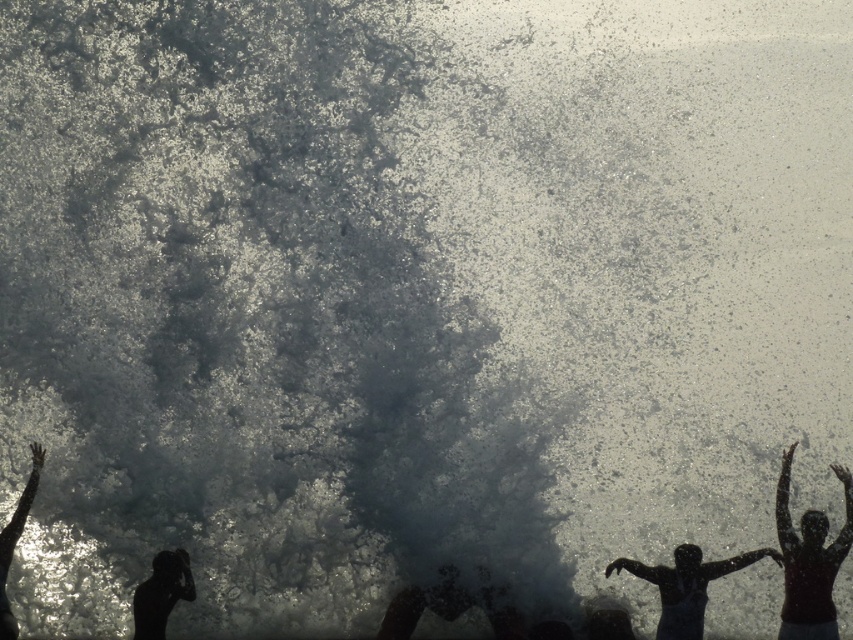
Can you confirm if silhouette human at lower right is shorter than black matte person at lower left?

In fact, silhouette human at lower right may be taller than black matte person at lower left.

Is point (759, 552) farther from viewer compared to point (169, 568)?

That is True.

Does point (606, 570) come behind point (141, 593)?

Yes, it is behind point (141, 593).

Where is `silhouette human at lower right`? The width and height of the screenshot is (853, 640). silhouette human at lower right is located at coordinates pos(686,586).

Which is behind, point (817, 579) or point (134, 637)?

The point (134, 637) is more distant.

Does silhouette human at right have a lesser height compared to black matte person at lower left?

In fact, silhouette human at right may be taller than black matte person at lower left.

Where is `silhouette human at right`? silhouette human at right is located at coordinates (809, 561).

Is black matte person at lower left wider than silhouette human at left?

Indeed, black matte person at lower left has a greater width compared to silhouette human at left.

Is black matte person at lower left thinner than silhouette human at left?

No, black matte person at lower left is not thinner than silhouette human at left.

Who is more distant from viewer, (184, 596) or (32, 452)?

Point (32, 452)

Identify the location of black matte person at lower left. The image size is (853, 640). (161, 593).